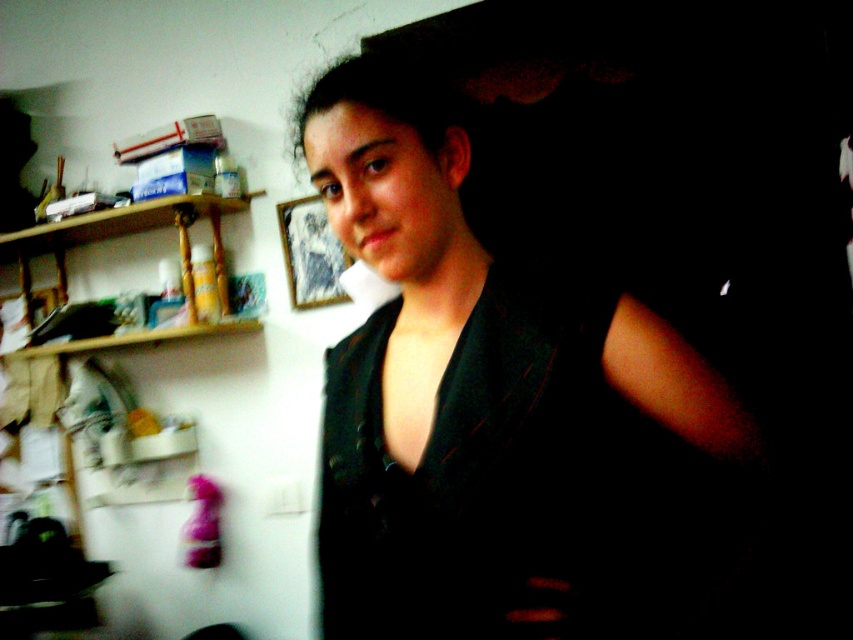
Question: Which object is positioned closest to the woodenmaterial/texturebookshelf at left?

Choices:
 (A) black satin dress at center
 (B) black matte dress at center

Answer: (B)

Question: Does black matte dress at center appear on the right side of black satin dress at center?

Choices:
 (A) no
 (B) yes

Answer: (B)

Question: Which of the following is the farthest from the observer?

Choices:
 (A) black satin dress at center
 (B) black matte dress at center
 (C) woodenmaterial/texturebookshelf at left

Answer: (C)

Question: Which point appears farthest from the camera in this image?

Choices:
 (A) (387, 588)
 (B) (192, 332)

Answer: (B)

Question: Does black matte dress at center appear on the left side of black satin dress at center?

Choices:
 (A) no
 (B) yes

Answer: (A)

Question: Is black satin dress at center below woodenmaterial/texturebookshelf at left?

Choices:
 (A) no
 (B) yes

Answer: (B)